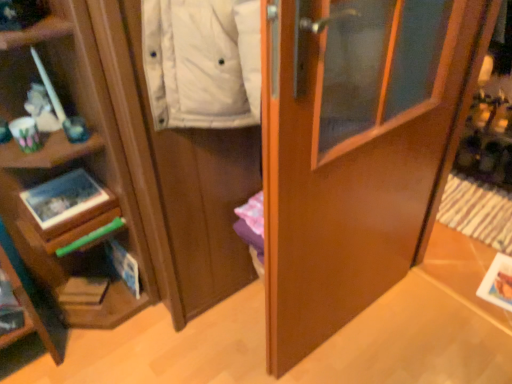
The image size is (512, 384). In order to click on vacant area that is situated to the right of glossy wood door at center in this screenshot , I will do `click(430, 325)`.